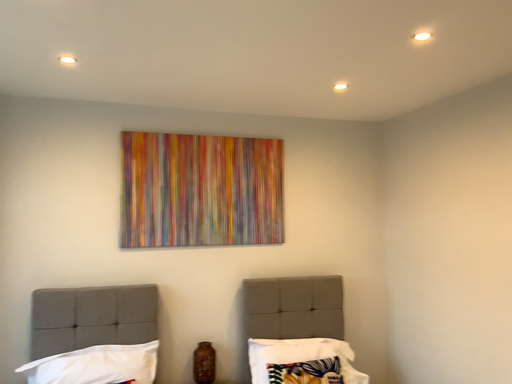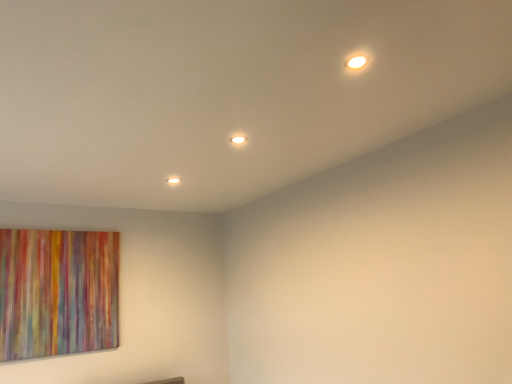
Question: Which way did the camera rotate in the video?

Choices:
 (A) rotated right
 (B) rotated left

Answer: (A)